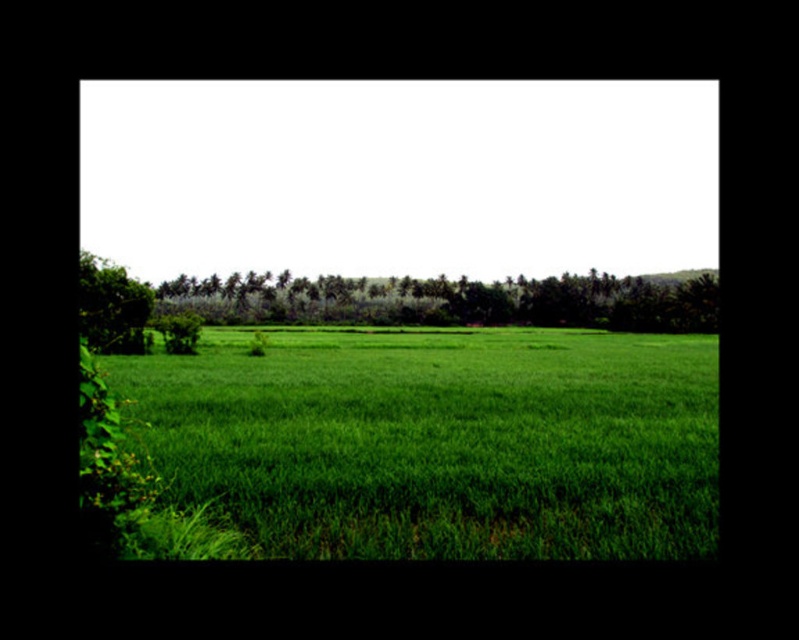
Based on the photo, you are standing in the middle of the green leafy trees at center and want to walk towards the green leafy tree at left. Which direction should you face to walk directly towards it?

You should face to the left because the green leafy trees at center are to the right of the green leafy tree at left, so moving left will lead you directly towards the green leafy tree at left.

Based on the photo, you are standing in the middle of the green fields and see the point marked as point (456, 300). What is the nearest object to you in the scene?

The nearest object to you is the green leafy trees at center represented by point (456, 300).

You are a drone operator trying to capture a photo of the green grassy field at center and the green leafy tree at left. From your current position, which object will appear closer to you in the photo?

The green grassy field at center will appear closer to you in the photo because the green leafy tree at left is positioned behind it.